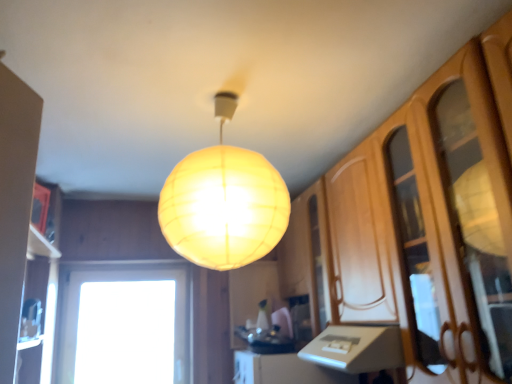
Question: Is translucent yellow sphere at center positioned with its back to wooden cabinet at right?

Choices:
 (A) no
 (B) yes

Answer: (A)

Question: Can you confirm if translucent yellow sphere at center is wider than wooden cabinet at right?

Choices:
 (A) no
 (B) yes

Answer: (B)

Question: Can you confirm if translucent yellow sphere at center is smaller than wooden cabinet at right?

Choices:
 (A) no
 (B) yes

Answer: (B)

Question: From a real-world perspective, is translucent yellow sphere at center located beneath wooden cabinet at right?

Choices:
 (A) no
 (B) yes

Answer: (A)

Question: From the image's perspective, is translucent yellow sphere at center on top of wooden cabinet at right?

Choices:
 (A) no
 (B) yes

Answer: (B)

Question: Is wooden cabinet at right surrounded by translucent yellow sphere at center?

Choices:
 (A) no
 (B) yes

Answer: (A)

Question: Is transparent glass window at lower left taller than wooden cabinet at right?

Choices:
 (A) yes
 (B) no

Answer: (B)

Question: Is transparent glass window at lower left shorter than wooden cabinet at right?

Choices:
 (A) no
 (B) yes

Answer: (B)

Question: Can you confirm if transparent glass window at lower left is wider than wooden cabinet at right?

Choices:
 (A) yes
 (B) no

Answer: (B)

Question: Could you tell me if transparent glass window at lower left is facing wooden cabinet at right?

Choices:
 (A) no
 (B) yes

Answer: (A)

Question: Are transparent glass window at lower left and wooden cabinet at right making contact?

Choices:
 (A) no
 (B) yes

Answer: (A)

Question: From a real-world perspective, is transparent glass window at lower left positioned under wooden cabinet at right based on gravity?

Choices:
 (A) yes
 (B) no

Answer: (A)

Question: From a real-world perspective, is wooden cabinet at right positioned under translucent yellow sphere at center based on gravity?

Choices:
 (A) no
 (B) yes

Answer: (B)